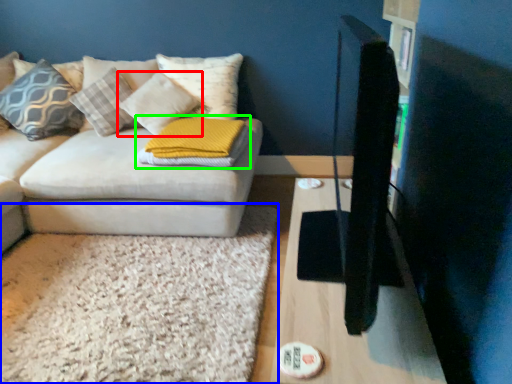
Question: Based on their relative distances, which object is nearer to pillow (highlighted by a red box)? Choose from mat (highlighted by a blue box) and pillow (highlighted by a green box).

Choices:
 (A) mat
 (B) pillow

Answer: (B)